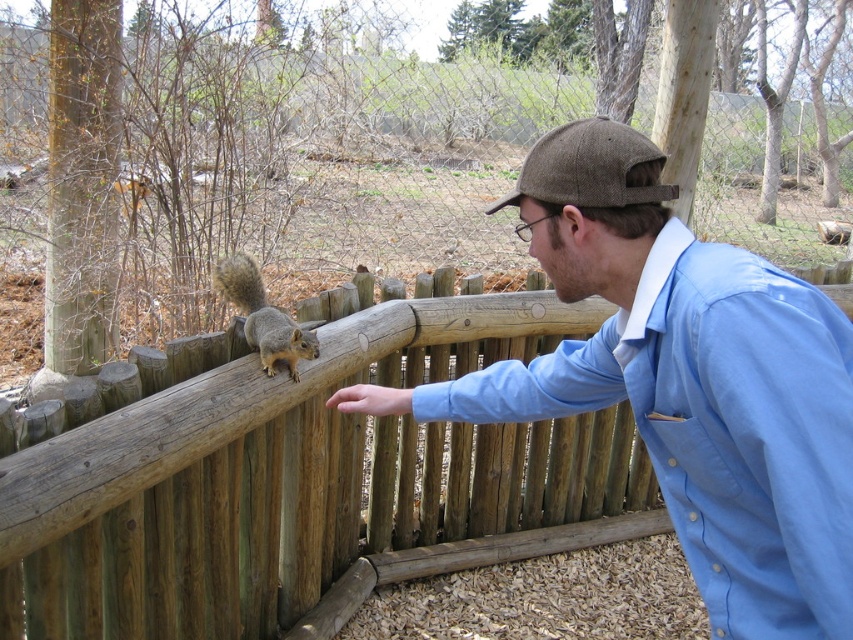
You are standing near the man and want to toss a small nut to the gray fur squirrel at center. The throwing distance is 8 feet. Can you reach the squirrel with your throw?

The gray fur squirrel at center and viewer are 8.01 feet apart, so the throwing distance of 8 feet is slightly shorter than the required distance. You cannot reach the squirrel with your throw.

You are a photographer trying to capture the man and the squirrel in focus. You notice two points of interest in the scene marked as point 1 at coordinates point (303,339) and point 2 at coordinates point (335,400). Which point is closer to the camera?

Point (303,339) is further to the camera than point (335,400). Therefore, point (335,400) is closer to the camera.

Based on the photo, you are holding a camera and want to take a photo of the man wearing the blue cotton shirt at center. If you are standing 3.82 feet away from him, is the distance sufficient to capture his entire body in the frame?

The blue cotton shirt at center and camera are 3.82 feet apart from each other. This distance may be too close to capture the entire body in the frame, as 3.82 feet is approximately 1.16 meters, which might require a wide angle lens to include the whole figure.